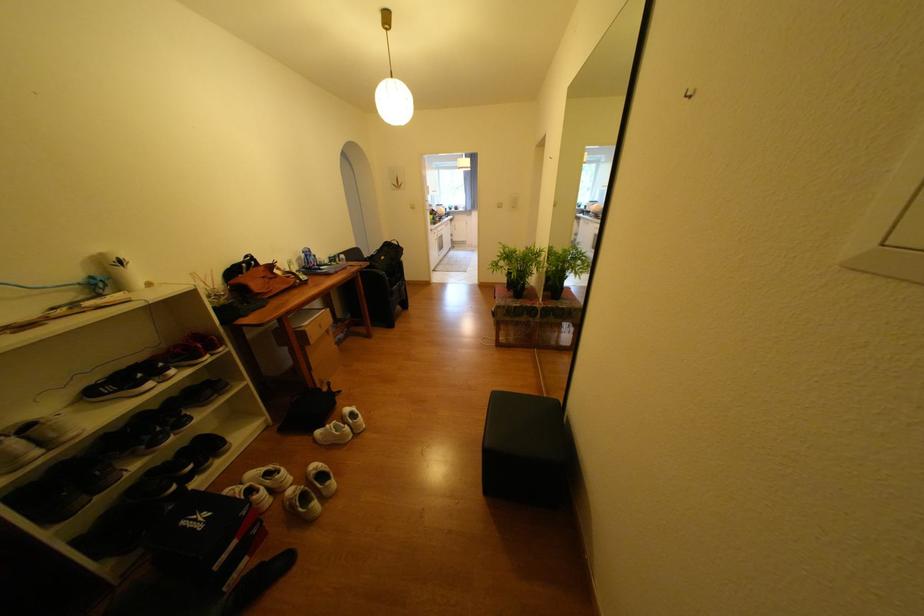
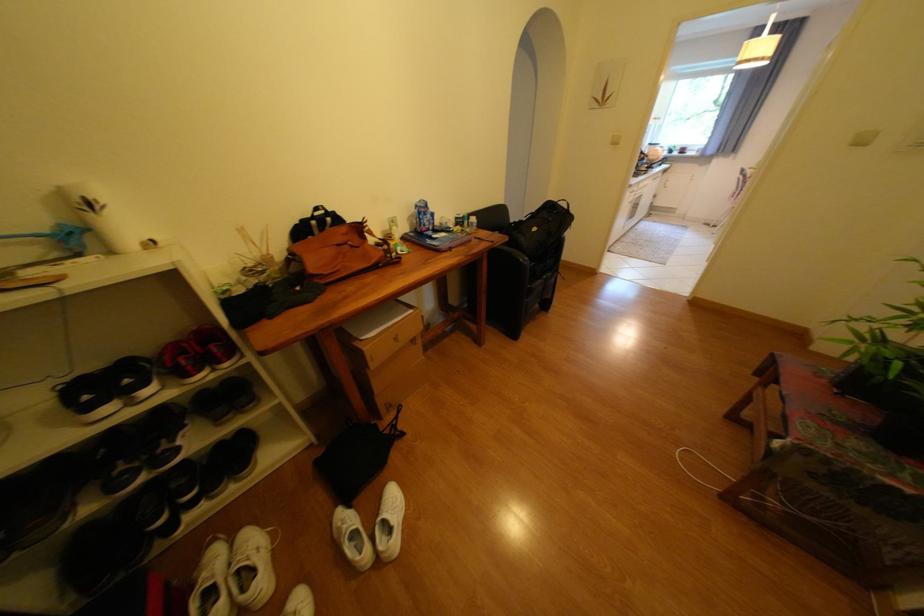
Locate, in the second image, the point that corresponds to (130,262) in the first image.

(100, 205)